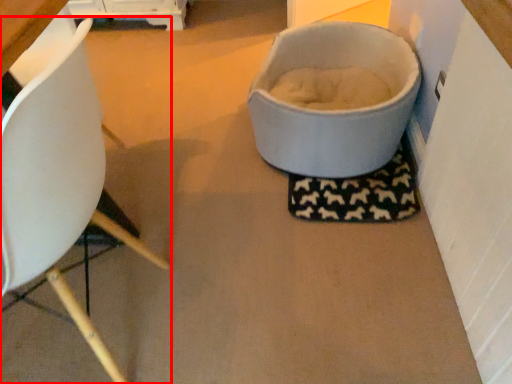
Question: From the image's perspective, what is the correct spatial positioning of chair (annotated by the red box) in reference to toilet bowl?

Choices:
 (A) above
 (B) below

Answer: (B)